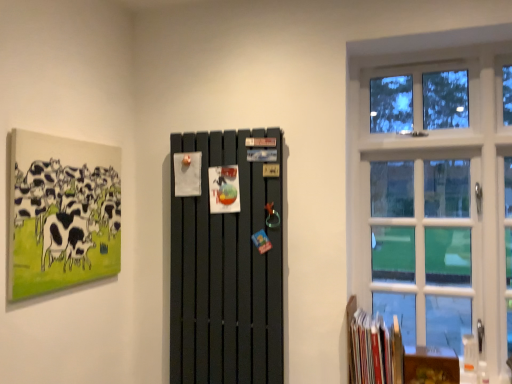
Question: Is hardcover books at lower right smaller than white glass window at right?

Choices:
 (A) no
 (B) yes

Answer: (B)

Question: Is the depth of hardcover books at lower right greater than that of white glass window at right?

Choices:
 (A) yes
 (B) no

Answer: (B)

Question: From a real-world perspective, does hardcover books at lower right stand above white glass window at right?

Choices:
 (A) yes
 (B) no

Answer: (B)

Question: From the image's perspective, does hardcover books at lower right appear lower than white glass window at right?

Choices:
 (A) no
 (B) yes

Answer: (B)

Question: Is hardcover books at lower right next to white glass window at right?

Choices:
 (A) yes
 (B) no

Answer: (B)

Question: Based on their sizes in the image, would you say matte black radiator at center is bigger or smaller than hardcover books at lower right?

Choices:
 (A) small
 (B) big

Answer: (B)

Question: Considering the positions of matte black radiator at center and hardcover books at lower right in the image, is matte black radiator at center wider or thinner than hardcover books at lower right?

Choices:
 (A) thin
 (B) wide

Answer: (A)

Question: From the image's perspective, is matte black radiator at center located above or below hardcover books at lower right?

Choices:
 (A) below
 (B) above

Answer: (B)

Question: In the image, is matte black radiator at center positioned in front of or behind hardcover books at lower right?

Choices:
 (A) behind
 (B) front

Answer: (B)

Question: From the image's perspective, is white glass window at right above or below matte canvas painting of cows at upper left?

Choices:
 (A) below
 (B) above

Answer: (A)

Question: Considering the positions of white glass window at right and matte canvas painting of cows at upper left in the image, is white glass window at right wider or thinner than matte canvas painting of cows at upper left?

Choices:
 (A) wide
 (B) thin

Answer: (A)

Question: Do you think white glass window at right is within matte canvas painting of cows at upper left, or outside of it?

Choices:
 (A) inside
 (B) outside

Answer: (B)

Question: In the image, is white glass window at right positioned in front of or behind matte canvas painting of cows at upper left?

Choices:
 (A) front
 (B) behind

Answer: (B)

Question: From a real-world perspective, relative to white glass window at right, is hardcover books at lower right vertically above or below?

Choices:
 (A) above
 (B) below

Answer: (B)

Question: From the image's perspective, is hardcover books at lower right above or below white glass window at right?

Choices:
 (A) below
 (B) above

Answer: (A)